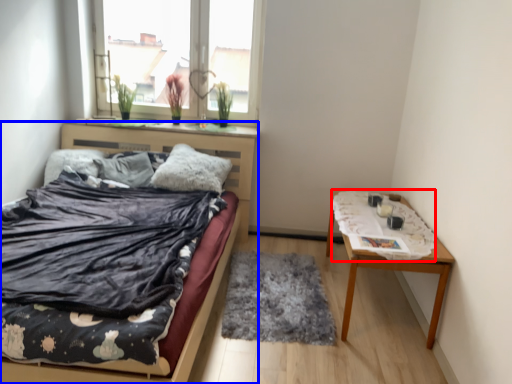
Question: Which object appears farthest to the camera in this image, blanket (highlighted by a red box) or bed (highlighted by a blue box)?

Choices:
 (A) blanket
 (B) bed

Answer: (A)